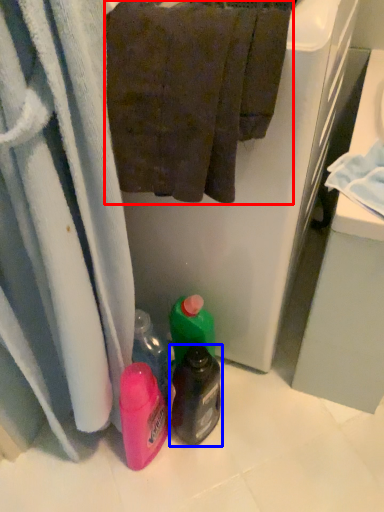
Question: Which of the following is the closest to the observer, towel (highlighted by a red box) or bottle (highlighted by a blue box)?

Choices:
 (A) towel
 (B) bottle

Answer: (A)